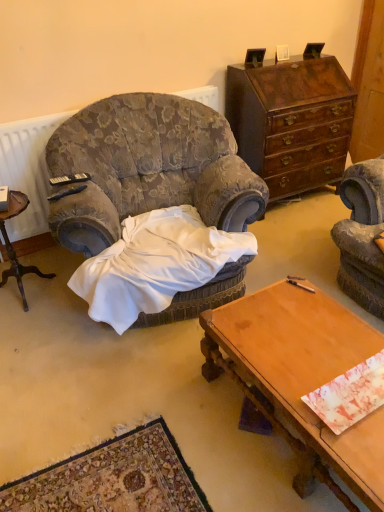
Identify the location of free area below wooden nightstand at left (from a real-world perspective). The image size is (384, 512). (16, 298).